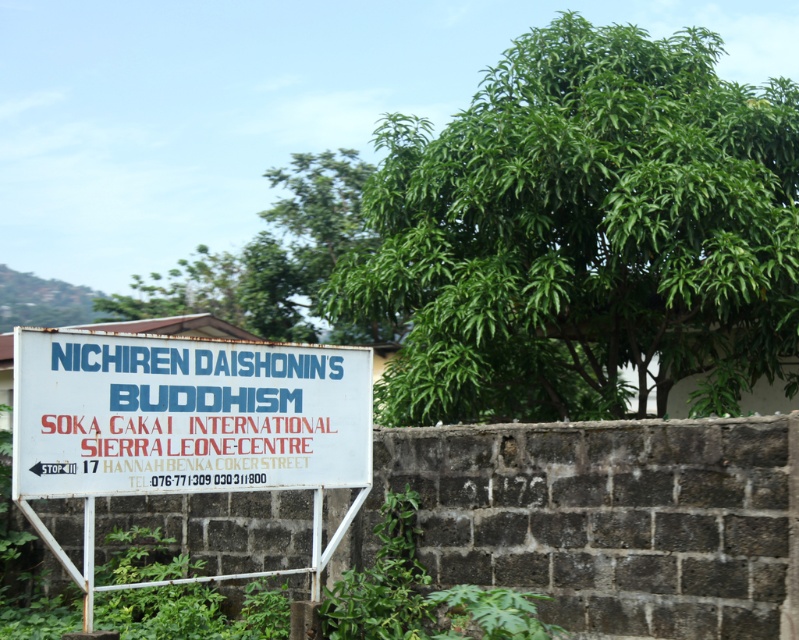
Question: Is white plastic sign at center above green leafy tree at upper center?

Choices:
 (A) no
 (B) yes

Answer: (A)

Question: Considering the real-world distances, which object is farthest from the green leafy tree at upper center?

Choices:
 (A) white plastic sign at center
 (B) green leafy tree at upper right

Answer: (A)

Question: Which of the following is the farthest from the observer?

Choices:
 (A) (207, 470)
 (B) (487, 305)

Answer: (B)

Question: Does green leafy tree at upper right appear under green leafy tree at upper center?

Choices:
 (A) yes
 (B) no

Answer: (A)

Question: Does green leafy tree at upper right appear on the left side of white plastic sign at center?

Choices:
 (A) no
 (B) yes

Answer: (A)

Question: Which point is farther from the camera taking this photo?

Choices:
 (A) (614, 413)
 (B) (199, 301)
 (C) (116, 364)

Answer: (B)